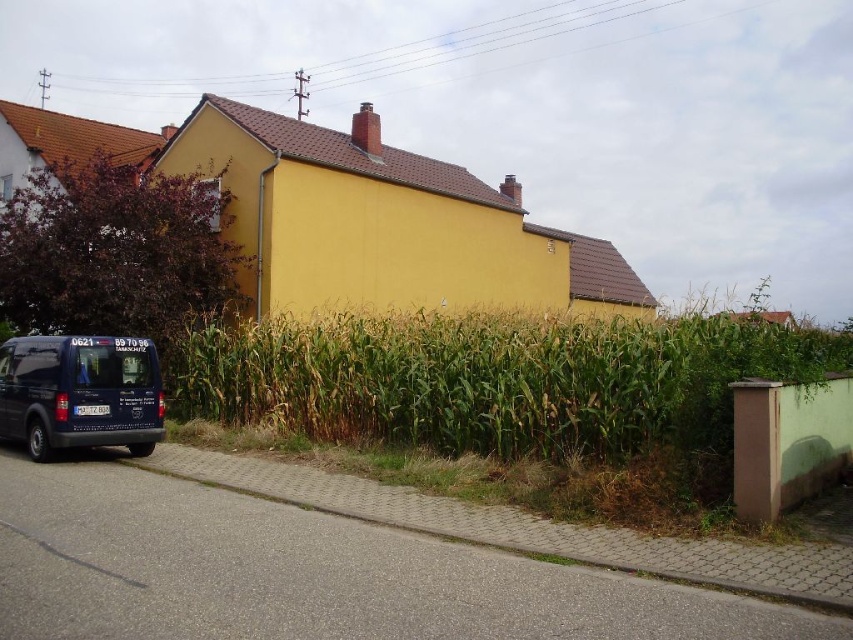
You are a delivery person arriving at the yellow house. You see the green leafy corn at center and the matte black van at lower left. Which object is closer to the road?

The matte black van at lower left is closer to the road because the green leafy corn at center is to the right of the matte black van at lower left, implying the van is positioned between the corn and the road.

You are a delivery driver who needs to park your 2.5 meter wide truck next to the gray concrete curb at lower left and the matte black van at lower left. Can you safely park your truck between them without overlapping either?

The gray concrete curb at lower left is smaller than the matte black van at lower left. However, the exact distance between them isn not provided in the objects description. Therefore, it is uncertain if there is enough space to park the truck safely between them.

You are a delivery person approaching the yellow house and need to park your dark blue van. The gray concrete curb at lower left is where you want to park. However, you notice another vehicle already parked there. Is the matte black van at lower left blocking the curb? Please explain.

The gray concrete curb at lower left is to the right of matte black van at lower left. Since the curb is positioned to the right of the van, the matte black van at lower left is parked near the curb, which means it is blocking access to the curb for parking.